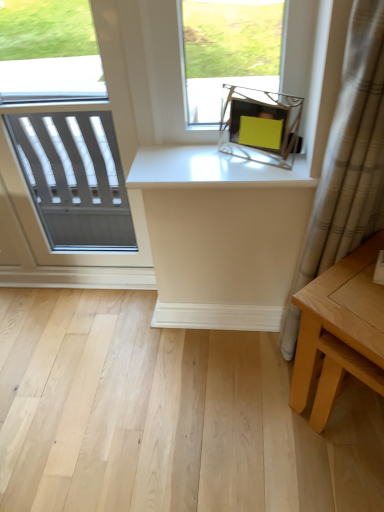
Question: Is white textured window at left to the right of white glossy counter top at upper center from the viewer's perspective?

Choices:
 (A) yes
 (B) no

Answer: (B)

Question: Does white textured window at left touch white glossy counter top at upper center?

Choices:
 (A) no
 (B) yes

Answer: (A)

Question: From the image's perspective, is white textured window at left below white glossy counter top at upper center?

Choices:
 (A) yes
 (B) no

Answer: (B)

Question: Is white textured window at left positioned far away from white glossy counter top at upper center?

Choices:
 (A) no
 (B) yes

Answer: (A)

Question: Considering the relative sizes of white textured window at left and white glossy counter top at upper center in the image provided, is white textured window at left shorter than white glossy counter top at upper center?

Choices:
 (A) yes
 (B) no

Answer: (B)

Question: Could you tell me if white textured window at left is facing white glossy counter top at upper center?

Choices:
 (A) no
 (B) yes

Answer: (A)

Question: Does white glossy counter top at upper center appear on the left side of white textured window at left?

Choices:
 (A) yes
 (B) no

Answer: (B)

Question: From the image's perspective, does white glossy counter top at upper center appear lower than white textured window at left?

Choices:
 (A) no
 (B) yes

Answer: (B)

Question: From a real-world perspective, is white glossy counter top at upper center on white textured window at left?

Choices:
 (A) yes
 (B) no

Answer: (A)

Question: Can you confirm if white glossy counter top at upper center is bigger than white textured window at left?

Choices:
 (A) no
 (B) yes

Answer: (A)

Question: Is white glossy counter top at upper center next to white textured window at left and touching it?

Choices:
 (A) yes
 (B) no

Answer: (B)

Question: Is white glossy counter top at upper center outside of white textured window at left?

Choices:
 (A) yes
 (B) no

Answer: (A)

Question: Is there a large distance between beige textured curtain at right and light brown wooden table at lower right?

Choices:
 (A) yes
 (B) no

Answer: (B)